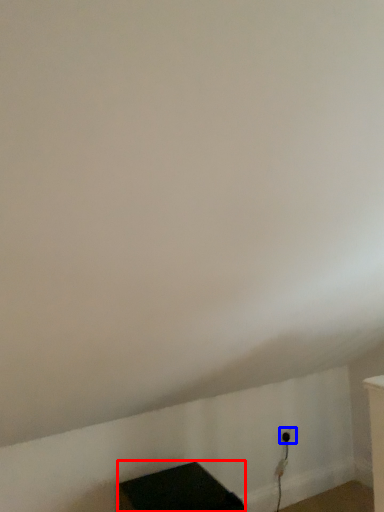
Question: Among these objects, which one is nearest to the camera, furniture (highlighted by a red box) or electric outlet (highlighted by a blue box)?

Choices:
 (A) furniture
 (B) electric outlet

Answer: (A)